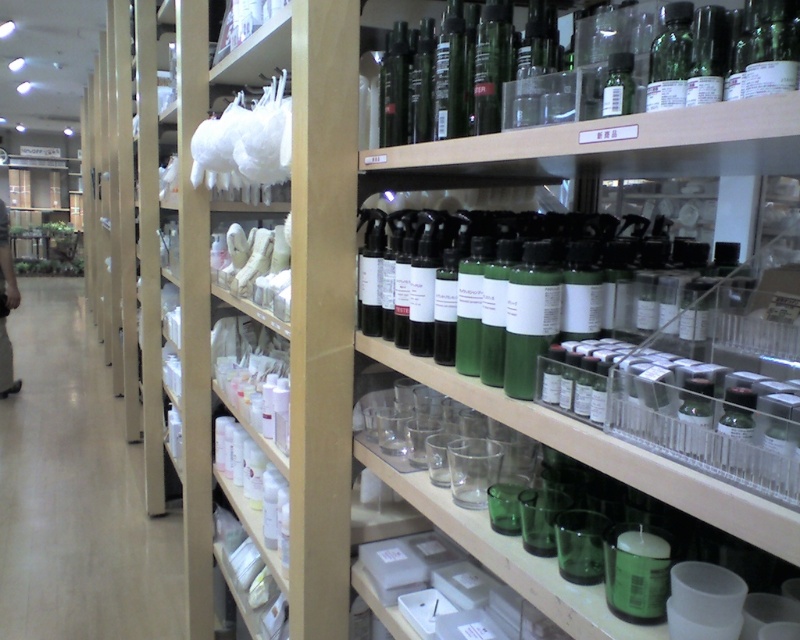
You are a customer looking to buy a taller item. You see the white plastic cups at left and the green glass bottle at upper right. Which one should you choose?

The green glass bottle at upper right is taller than the white plastic cups at left, so you should choose the green glass bottle at upper right.

You are a store employee trying to organize the shelves. You have a green glass bottle at upper right and a green glass bottle at center. Which bottle requires a wider space on the shelf?

The green glass bottle at center requires a wider space on the shelf because it has a greater width compared to the green glass bottle at upper right.

You are a customer in the store and want to reach both the point at coordinates (132, 634) and the point at coordinates (690, 65). Which point should you approach first to ensure you can reach them without moving your position?

You should approach the point at coordinates (132, 634) first because it is closer to you than the point at coordinates (690, 65), which is further away.